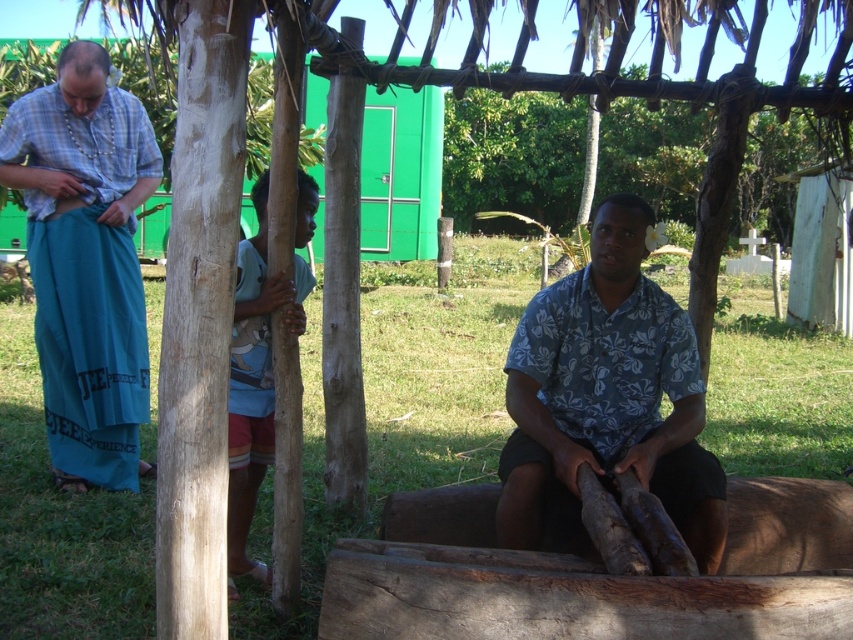
Between point (106, 240) and point (527, 173), which one is positioned behind?

Positioned behind is point (527, 173).

Does teal fabric sarong at left appear under brown rough wood at upper center?

Indeed, teal fabric sarong at left is positioned under brown rough wood at upper center.

Which is in front, point (138, 419) or point (776, 138)?

Point (138, 419) is more forward.

Where is `teal fabric sarong at left`? This screenshot has width=853, height=640. teal fabric sarong at left is located at coordinates click(x=86, y=260).

Between brown rough wood at upper center and light blue fabric at center, which one is positioned lower?

light blue fabric at center is lower down.

Does brown rough wood at upper center have a larger size compared to light blue fabric at center?

Indeed, brown rough wood at upper center has a larger size compared to light blue fabric at center.

Is point (531, 204) less distant than point (233, 364)?

No, (531, 204) is behind (233, 364).

Where is `brown rough wood at upper center`? This screenshot has height=640, width=853. brown rough wood at upper center is located at coordinates (512, 157).

Is floral print shirt at center positioned at the back of teal fabric sarong at left?

No, it is not.

What do you see at coordinates (606, 397) in the screenshot? The height and width of the screenshot is (640, 853). I see `floral print shirt at center` at bounding box center [606, 397].

Where is `floral print shirt at center`? The height and width of the screenshot is (640, 853). floral print shirt at center is located at coordinates (606, 397).